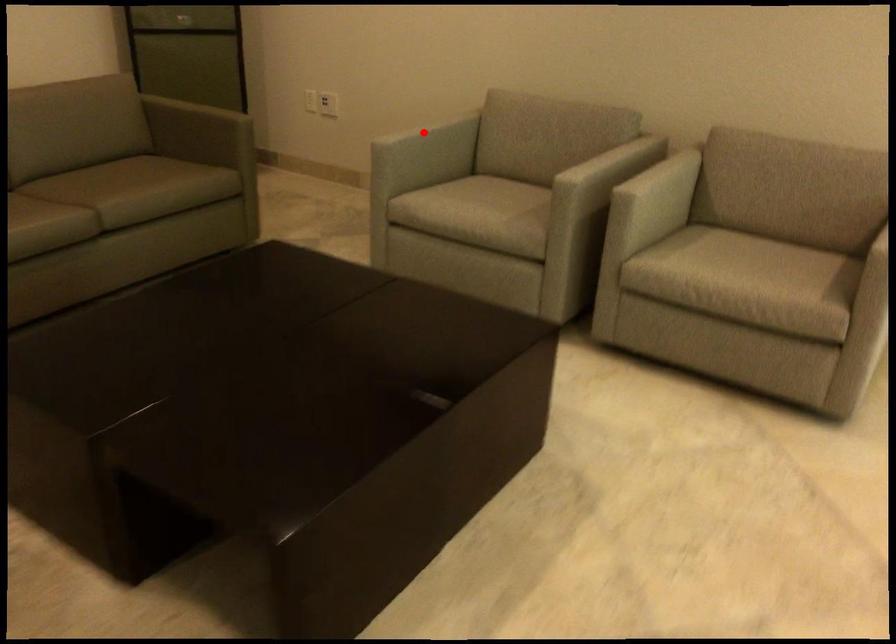
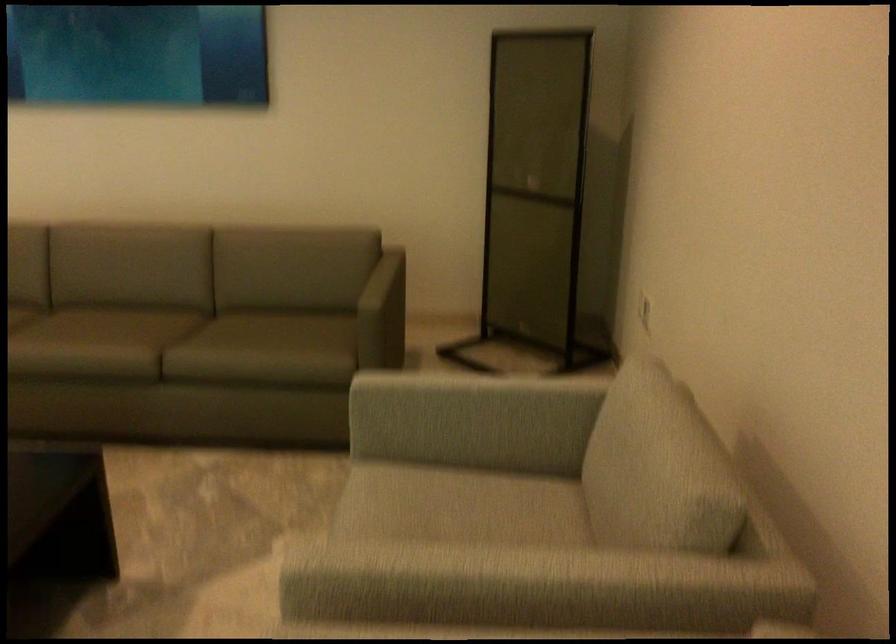
Where in the second image is the point corresponding to the highlighted location from the first image?

(469, 399)